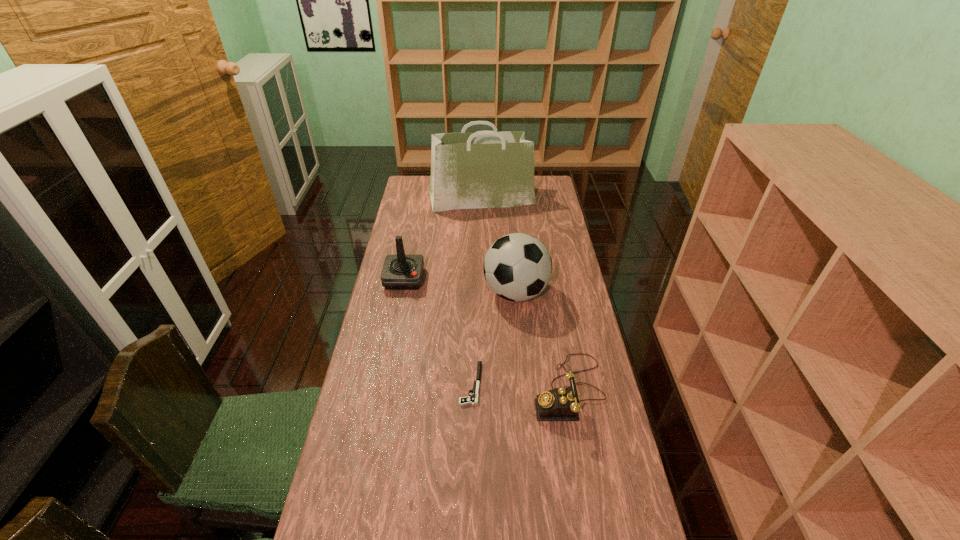
Identify the location of object that stands as the second closest to the joystick. The width and height of the screenshot is (960, 540). (473, 399).

Locate an element on the screen. The image size is (960, 540). object that ranks as the second closest to the pistol is located at coordinates (517, 267).